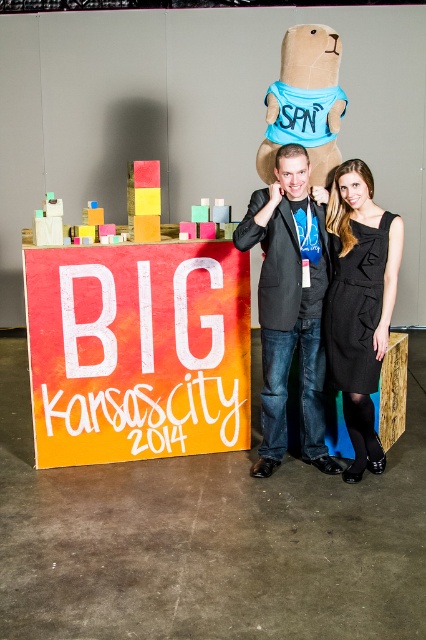
Does orange painted wood sign at center have a larger size compared to black textured dress at center?

Indeed, orange painted wood sign at center has a larger size compared to black textured dress at center.

Can you confirm if orange painted wood sign at center is positioned above black textured dress at center?

No.

Is point (178, 253) farther from camera compared to point (328, 376)?

Yes, it is behind point (328, 376).

Identify the location of orange painted wood sign at center. The width and height of the screenshot is (426, 640). (138, 349).

Who is higher up, orange painted wood sign at center or matte black blazer at center?

matte black blazer at center

Where is `orange painted wood sign at center`? The image size is (426, 640). orange painted wood sign at center is located at coordinates (138, 349).

Find the location of a particular element. orange painted wood sign at center is located at coordinates (138, 349).

Find the location of a particular element. orange painted wood sign at center is located at coordinates (138, 349).

Is matte black blazer at center wider than black textured dress at center?

Indeed, matte black blazer at center has a greater width compared to black textured dress at center.

Where is `matte black blazer at center`? The image size is (426, 640). matte black blazer at center is located at coordinates (290, 305).

Find the location of `matte black blazer at center`. matte black blazer at center is located at coordinates (290, 305).